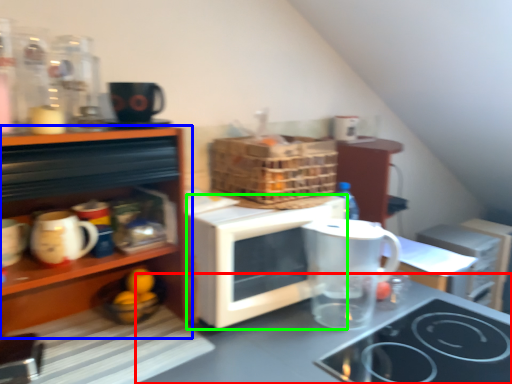
Question: Which object is the closest to the countertop (highlighted by a red box)? Choose among these: cabinetry (highlighted by a blue box) or microwave oven (highlighted by a green box).

Choices:
 (A) cabinetry
 (B) microwave oven

Answer: (B)